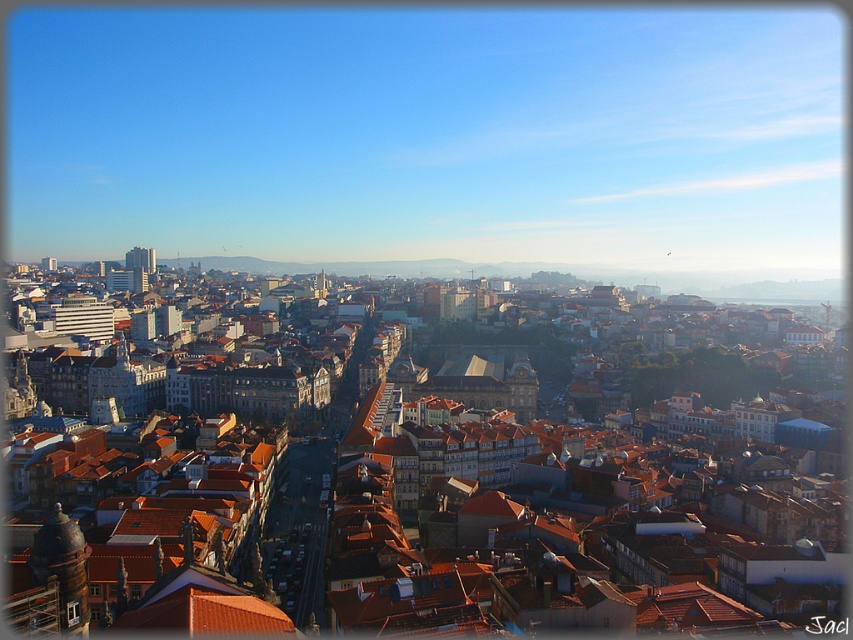
Can you confirm if brown stone tower at lower left is taller than matte white building at center?

No.

Describe the element at coordinates (62, 566) in the screenshot. I see `brown stone tower at lower left` at that location.

Between point (61, 630) and point (149, 272), which one is positioned in front?

Positioned in front is point (61, 630).

At what (x,y) coordinates should I click in order to perform the action: click on brown stone tower at lower left. Please return your answer as a coordinate pair (x, y). The width and height of the screenshot is (853, 640). Looking at the image, I should click on (62, 566).